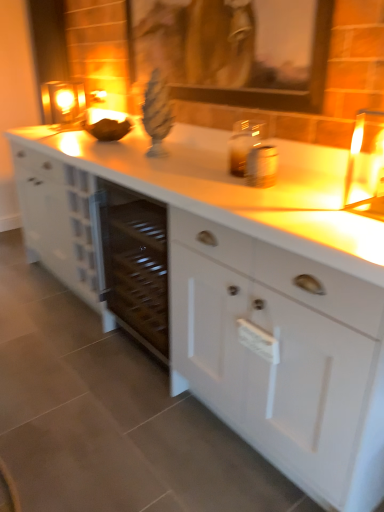
Question: Does wooden picture frame at upper center have a larger size compared to white matte cabinet at center?

Choices:
 (A) no
 (B) yes

Answer: (A)

Question: Considering the relative positions of wooden picture frame at upper center and white matte cabinet at center in the image provided, is wooden picture frame at upper center to the left of white matte cabinet at center from the viewer's perspective?

Choices:
 (A) yes
 (B) no

Answer: (A)

Question: Is wooden picture frame at upper center positioned with its back to white matte cabinet at center?

Choices:
 (A) yes
 (B) no

Answer: (B)

Question: Is wooden picture frame at upper center shorter than white matte cabinet at center?

Choices:
 (A) no
 (B) yes

Answer: (B)

Question: Is wooden picture frame at upper center at the right side of white matte cabinet at center?

Choices:
 (A) no
 (B) yes

Answer: (A)

Question: From a real-world perspective, is wooden picture frame at upper center on top of white matte cabinet at center?

Choices:
 (A) no
 (B) yes

Answer: (B)

Question: From the image's perspective, is white matte cabinet at center over wooden picture frame at upper center?

Choices:
 (A) no
 (B) yes

Answer: (A)

Question: Does white matte cabinet at center come behind wooden picture frame at upper center?

Choices:
 (A) yes
 (B) no

Answer: (B)

Question: Would you say white matte cabinet at center is a long distance from wooden picture frame at upper center?

Choices:
 (A) yes
 (B) no

Answer: (B)

Question: Can we say white matte cabinet at center lies outside wooden picture frame at upper center?

Choices:
 (A) yes
 (B) no

Answer: (A)

Question: Is white matte cabinet at center to the left of wooden picture frame at upper center from the viewer's perspective?

Choices:
 (A) no
 (B) yes

Answer: (A)

Question: Is white matte cabinet at center aimed at wooden picture frame at upper center?

Choices:
 (A) no
 (B) yes

Answer: (A)

Question: Is white matte cabinet at center positioned before matte glass candle at upper left?

Choices:
 (A) no
 (B) yes

Answer: (B)